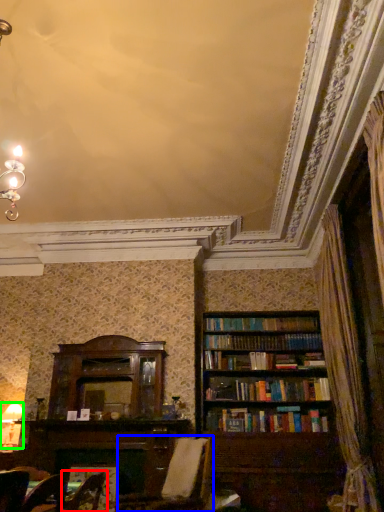
Question: Estimate the real-world distances between objects in this image. Which object is farther from armchair (highlighted by a red box), swivel chair (highlighted by a blue box) or lamp (highlighted by a green box)?

Choices:
 (A) swivel chair
 (B) lamp

Answer: (B)